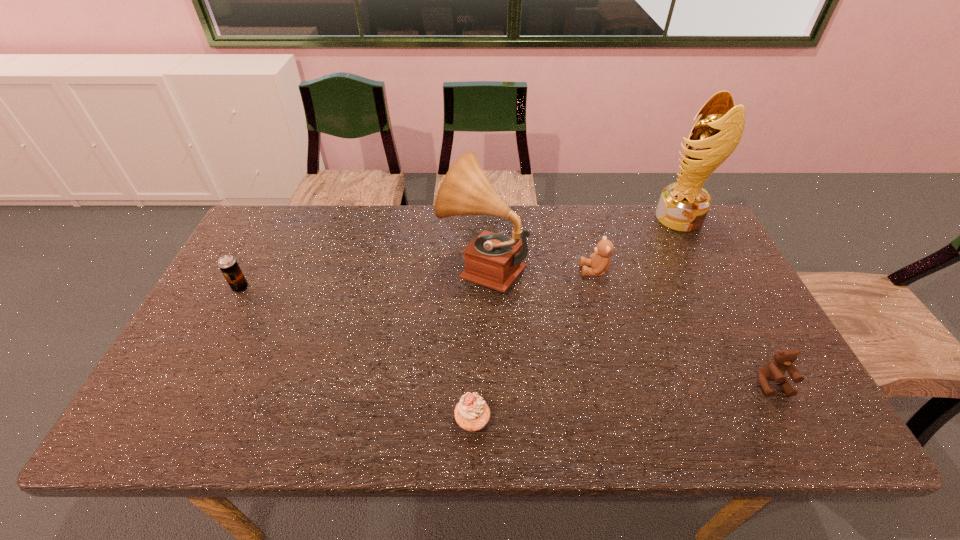
I want to click on free space located on the front-facing side of the award, so click(623, 217).

Locate an element on the screen. The image size is (960, 540). vacant space positioned 0.390m on the front-facing side of the award is located at coordinates (540, 217).

Identify the location of free space located 0.070m on the front-facing side of the award. The image size is (960, 540). (635, 217).

Locate an element on the screen. The width and height of the screenshot is (960, 540). vacant area located on the horn of the fifth shortest object is located at coordinates (340, 266).

At what (x,y) coordinates should I click in order to perform the action: click on vacant region located on the horn of the fifth shortest object. Please return your answer as a coordinate pair (x, y). The height and width of the screenshot is (540, 960). Looking at the image, I should click on (414, 266).

The height and width of the screenshot is (540, 960). Find the location of `vacant space located on the horn of the fifth shortest object`. vacant space located on the horn of the fifth shortest object is located at coordinates (306, 266).

I want to click on free space located on the face of the left teddy bear, so click(560, 271).

At what (x,y) coordinates should I click in order to perform the action: click on blank space located 0.100m on the face of the left teddy bear. Please return your answer as a coordinate pair (x, y). The width and height of the screenshot is (960, 540). Looking at the image, I should click on (546, 271).

This screenshot has height=540, width=960. I want to click on free space located 0.340m on the face of the left teddy bear, so click(465, 271).

Locate an element on the screen. vacant area situated on the back of the beer can is located at coordinates (268, 235).